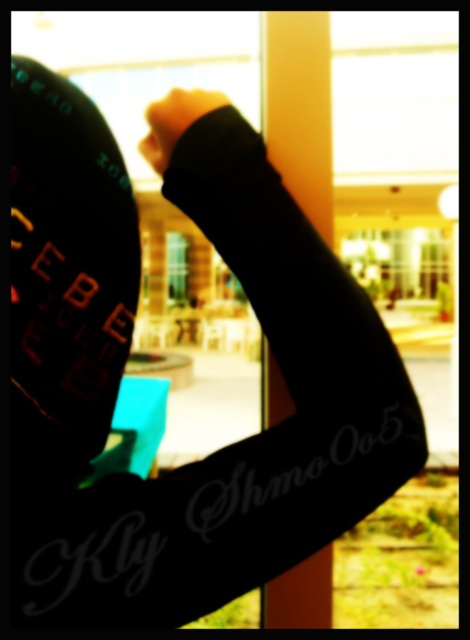
Question: Which of the following is the closest to the observer?

Choices:
 (A) black matte hand at center
 (B) clear glass window at center

Answer: (A)

Question: Which point appears farthest from the camera in this image?

Choices:
 (A) tap(200, 104)
 (B) tap(180, 236)

Answer: (B)

Question: Which of the following is the farthest from the observer?

Choices:
 (A) black matte hand at center
 (B) clear glass window at center

Answer: (B)

Question: Does black matte hand at center appear on the right side of clear glass window at center?

Choices:
 (A) yes
 (B) no

Answer: (A)

Question: Does black matte hand at center have a greater width compared to clear glass window at center?

Choices:
 (A) yes
 (B) no

Answer: (A)

Question: Is black matte hand at center wider than clear glass window at center?

Choices:
 (A) no
 (B) yes

Answer: (B)